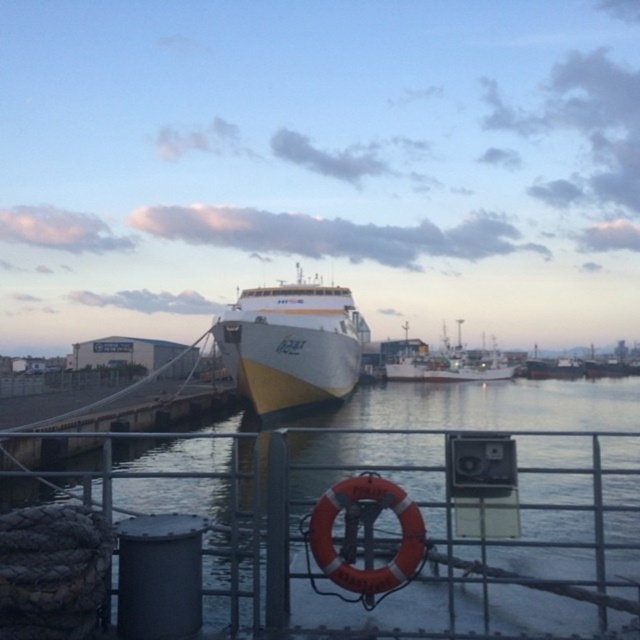
Is white glossy ferry at center positioned in front of white matte fishing boat at center?

Yes, white glossy ferry at center is closer to the viewer.

From the picture: Who is positioned more to the left, white glossy ferry at center or white matte fishing boat at center?

white glossy ferry at center is more to the left.

What do you see at coordinates (291, 342) in the screenshot?
I see `white glossy ferry at center` at bounding box center [291, 342].

Locate an element on the screen. white glossy ferry at center is located at coordinates (291, 342).

Who is more forward, (276, 438) or (502, 371)?

Positioned in front is point (276, 438).

Between point (520, 538) and point (435, 365), which one is positioned behind?

Point (435, 365)

The width and height of the screenshot is (640, 640). Identify the location of metal/rustic rail at center. (380, 540).

Which is more to the left, metal/rustic rail at center or white glossy ferry at center?

metal/rustic rail at center is more to the left.

Based on the photo, is metal/rustic rail at center positioned behind white glossy ferry at center?

No.

Describe the element at coordinates (380, 540) in the screenshot. I see `metal/rustic rail at center` at that location.

This screenshot has width=640, height=640. In order to click on metal/rustic rail at center in this screenshot , I will do `click(380, 540)`.